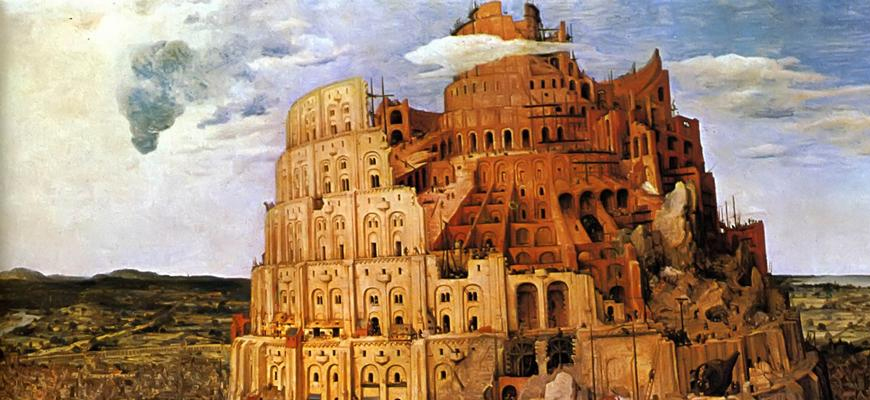
The width and height of the screenshot is (870, 400). I want to click on window, so click(370, 300).